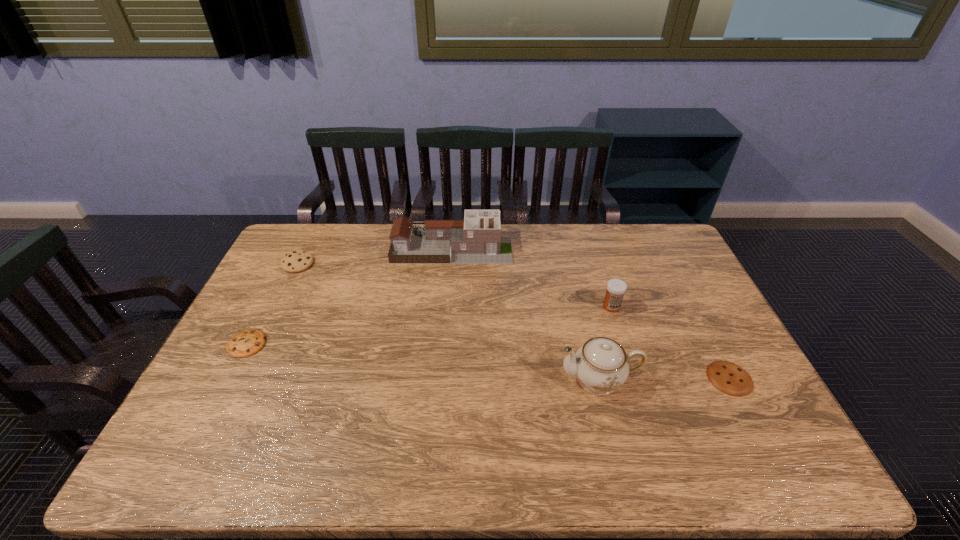
Locate an element on the screen. blank space located 0.140m at the spout of the chinaware is located at coordinates (507, 380).

Find the location of `free space located at the spout of the chinaware`. free space located at the spout of the chinaware is located at coordinates (533, 380).

Find the location of a particular element. The width and height of the screenshot is (960, 540). vacant space located at the spout of the chinaware is located at coordinates (420, 380).

The image size is (960, 540). I want to click on free space located on the left of the third farthest object, so click(500, 307).

Locate an element on the screen. Image resolution: width=960 pixels, height=540 pixels. vacant space located on the right of the third shortest object is located at coordinates [382, 264].

The image size is (960, 540). Find the location of `blank area located on the right of the second nearest cookie`. blank area located on the right of the second nearest cookie is located at coordinates (356, 344).

Locate an element on the screen. This screenshot has width=960, height=540. vacant space situated on the back of the rightmost cookie is located at coordinates (685, 292).

Find the location of a particular element. Image resolution: width=960 pixels, height=540 pixels. dollhouse present at the far edge is located at coordinates (477, 239).

The image size is (960, 540). I want to click on cookie present at the far edge, so click(297, 261).

You are a GUI agent. You are given a task and a screenshot of the screen. Output one action in this format:
    pyautogui.click(x=<x>, y=<y>)
    Task: Click on the object positioned at the right edge
    This screenshot has height=540, width=960.
    Given the screenshot: What is the action you would take?
    pyautogui.click(x=731, y=379)